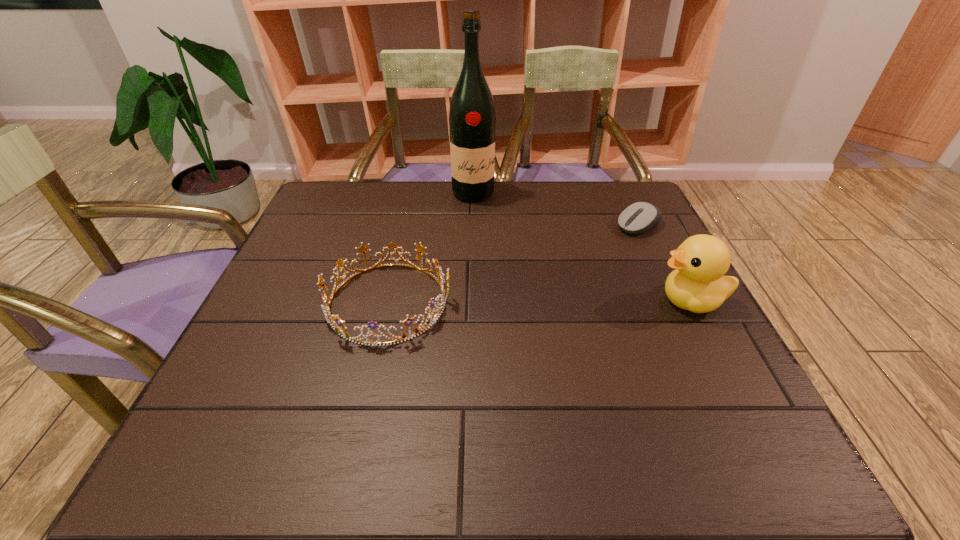
Where is `vacant space on the desktop that is between the tiara and the second tallest object and is positioned on the front-facing side of the farthest object`? The width and height of the screenshot is (960, 540). vacant space on the desktop that is between the tiara and the second tallest object and is positioned on the front-facing side of the farthest object is located at coordinates (541, 301).

Find the location of `free spot on the desktop that is between the tiara and the second tallest object and is positioned on the wheel side of the shortest object`. free spot on the desktop that is between the tiara and the second tallest object and is positioned on the wheel side of the shortest object is located at coordinates (513, 301).